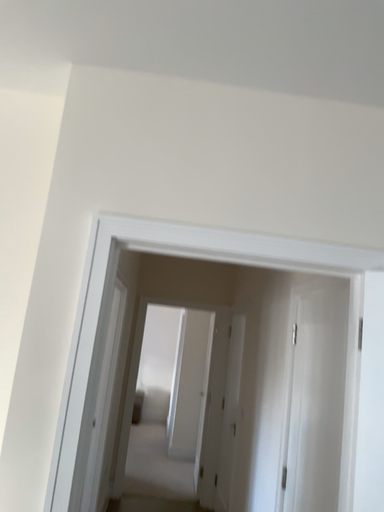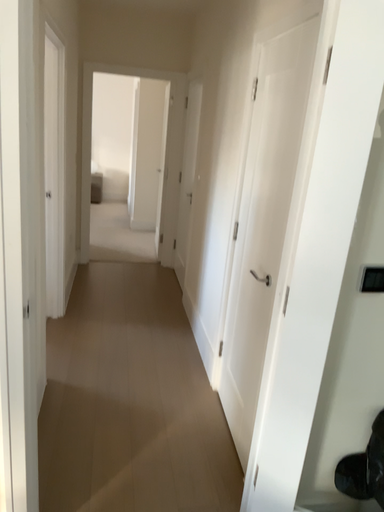
Question: Which way did the camera rotate in the video?

Choices:
 (A) rotated upward
 (B) rotated downward

Answer: (B)